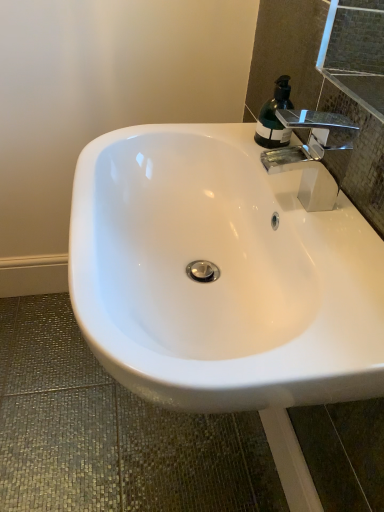
The height and width of the screenshot is (512, 384). I want to click on free space to the back side of chrome/metallic faucet at upper right, so click(275, 169).